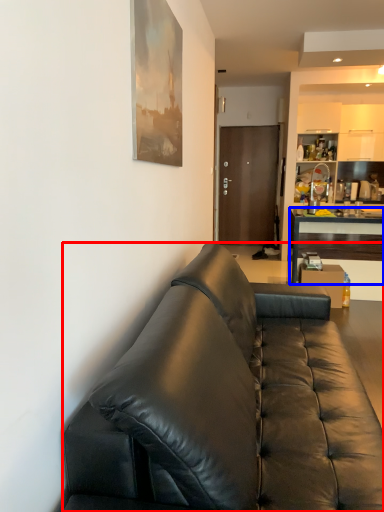
Question: Which object appears closest to the camera in this image, studio couch (highlighted by a red box) or desk (highlighted by a blue box)?

Choices:
 (A) studio couch
 (B) desk

Answer: (A)